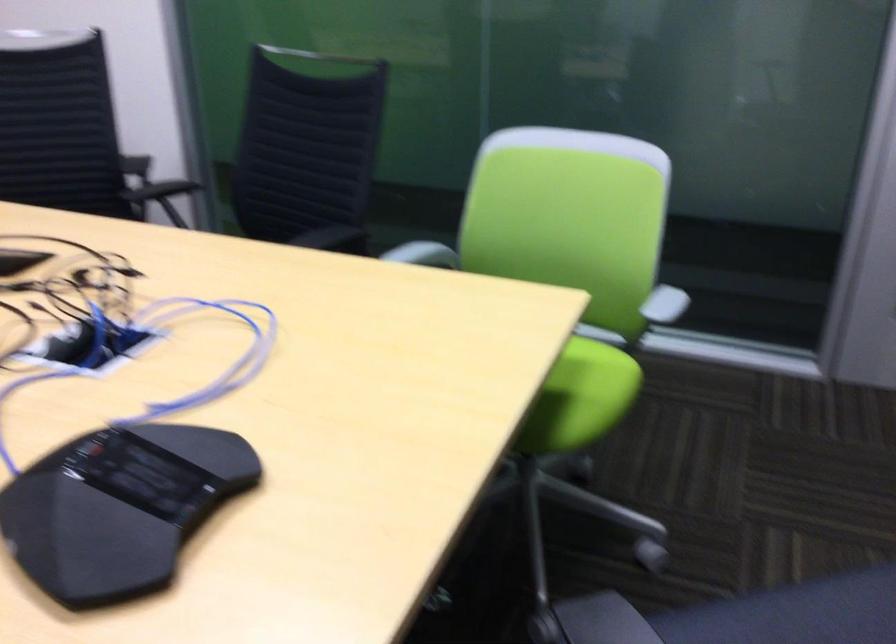
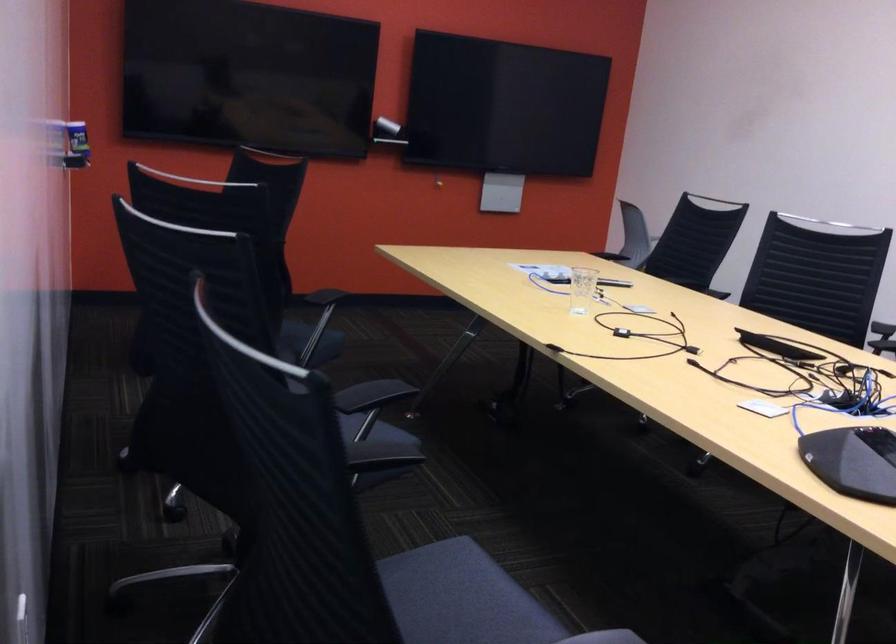
Question: The images are taken continuously from a first-person perspective. In which direction is your viewpoint rotating?

Choices:
 (A) Left
 (B) Right
 (C) Up
 (D) Down

Answer: (A)